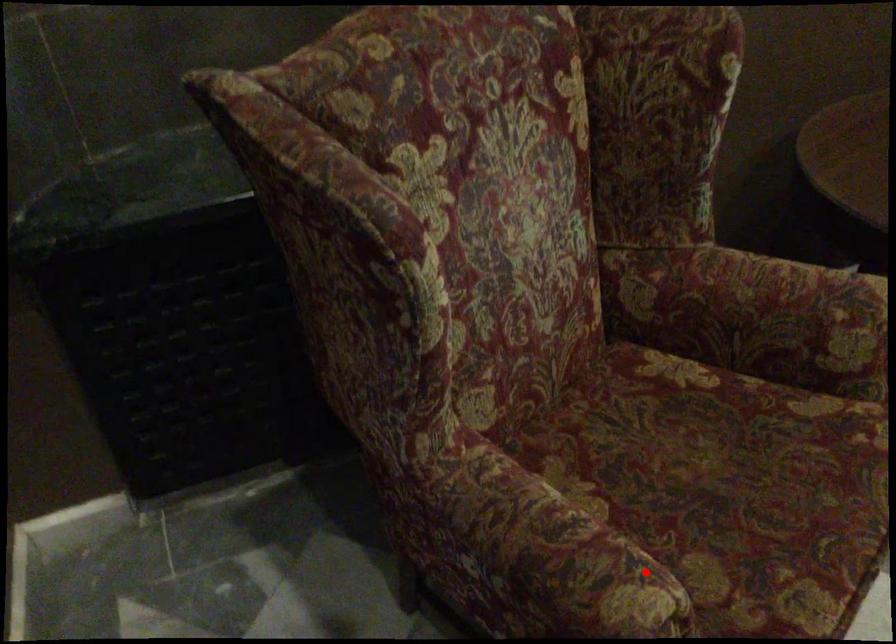
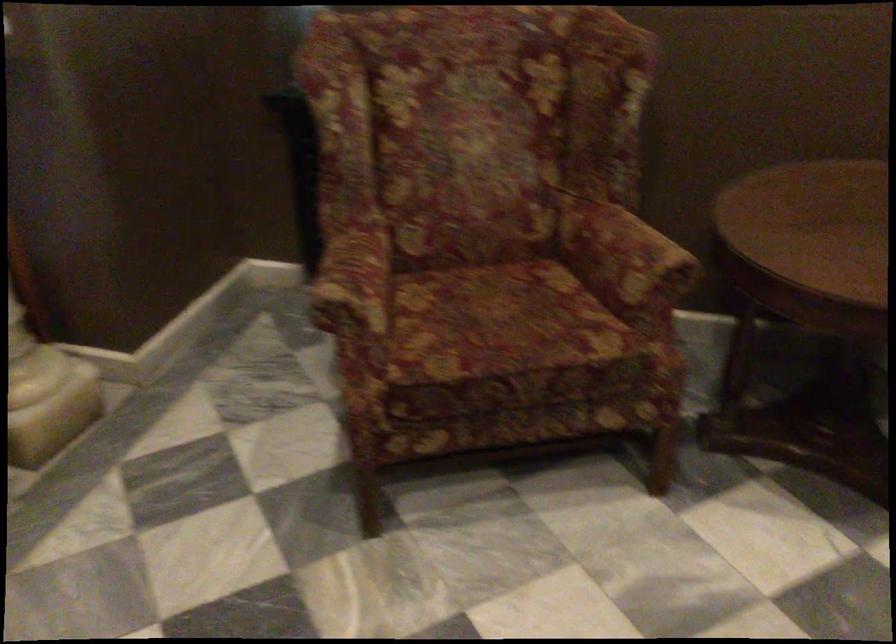
Locate, in the second image, the point that corresponds to the highlighted location in the first image.

(355, 286)